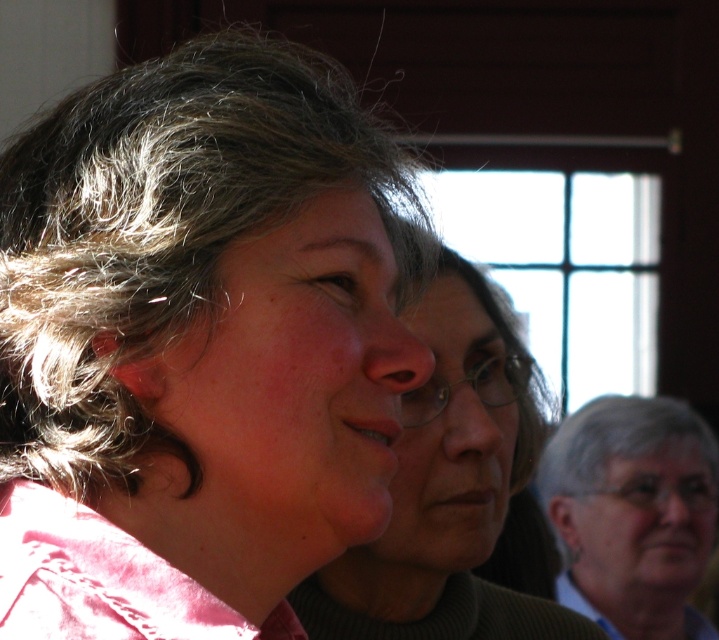
Question: Which point is farther to the camera?

Choices:
 (A) matte pink shirt at center
 (B) gray curly hair at center

Answer: (A)

Question: Is gray curly hair at center below matte pink shirt at center?

Choices:
 (A) no
 (B) yes

Answer: (A)

Question: Does gray curly hair at center have a larger size compared to matte pink shirt at center?

Choices:
 (A) yes
 (B) no

Answer: (B)

Question: Does gray curly hair at center appear on the right side of matte pink shirt at center?

Choices:
 (A) no
 (B) yes

Answer: (A)

Question: Which of the following is the closest to the observer?

Choices:
 (A) gray curly hair at center
 (B) matte pink shirt at center

Answer: (A)